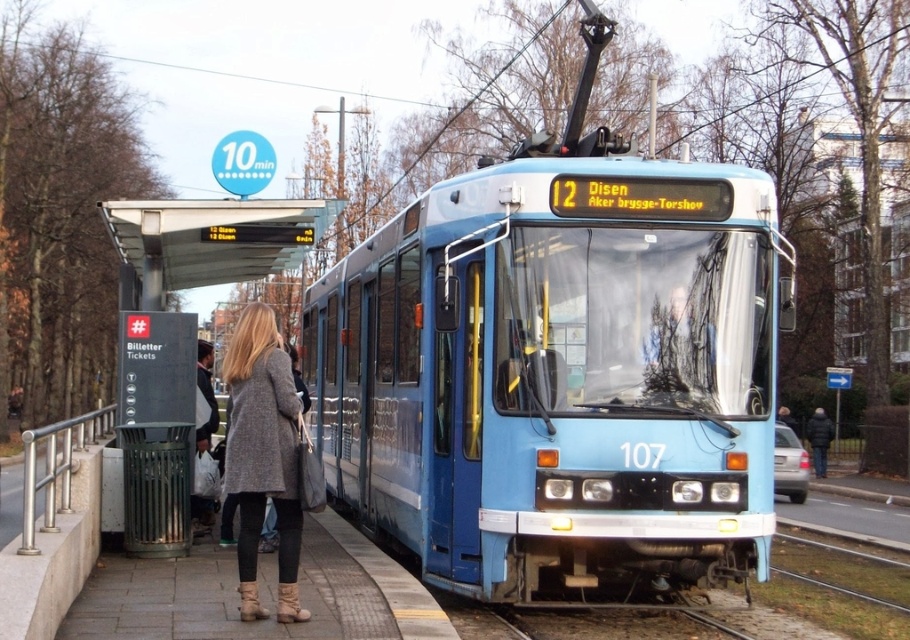
You are a passenger waiting at the tram station and want to board the blue metallic train at center. However, you are carrying a large gray wool coat at center. Considering their widths, will you be able to pass through the train doors without any issue?

The blue metallic train at center has a lesser width compared to gray wool coat at center. This means the coat is wider than the train doors, so you may have difficulty passing through without adjusting the coat.

You are standing at the tram station and want to know which of the two points, point (716, 301) or point (199, 532), is closer to you. Can you determine this based on the scene?

Point (716, 301) is closer to the viewer than point (199, 532).

You are a passenger waiting at the tram station. You see a blue metallic train at center and a white plastic bag at center. Which object is closer to the right edge of the platform?

The blue metallic train at center is positioned on the right side of the white plastic bag at center, so it is closer to the right edge of the platform.